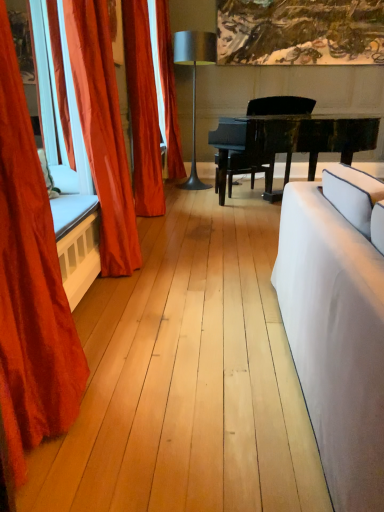
Image resolution: width=384 pixels, height=512 pixels. Find the location of `free space to the back side of velvet red curtain at left, marked as the 1th curtain in a front-to-back arrangement`. free space to the back side of velvet red curtain at left, marked as the 1th curtain in a front-to-back arrangement is located at coordinates [x=113, y=341].